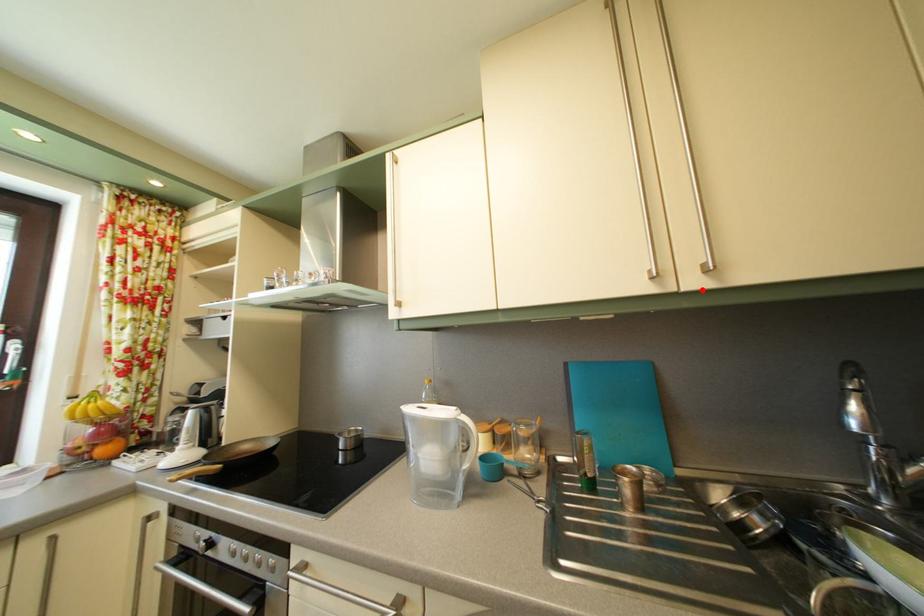
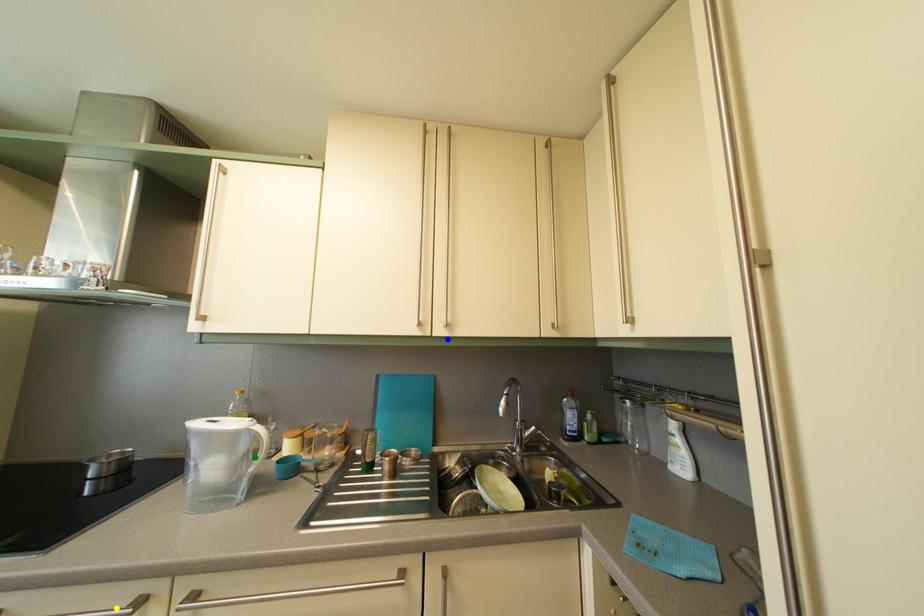
Question: I am providing you with two images of the same scene from different viewpoints. A red point is marked on the first image. You are given multiple points on the second image. Which point in image 2 represents the same 3d spot as the red point in image 1?

Choices:
 (A) green point
 (B) yellow point
 (C) blue point

Answer: (C)